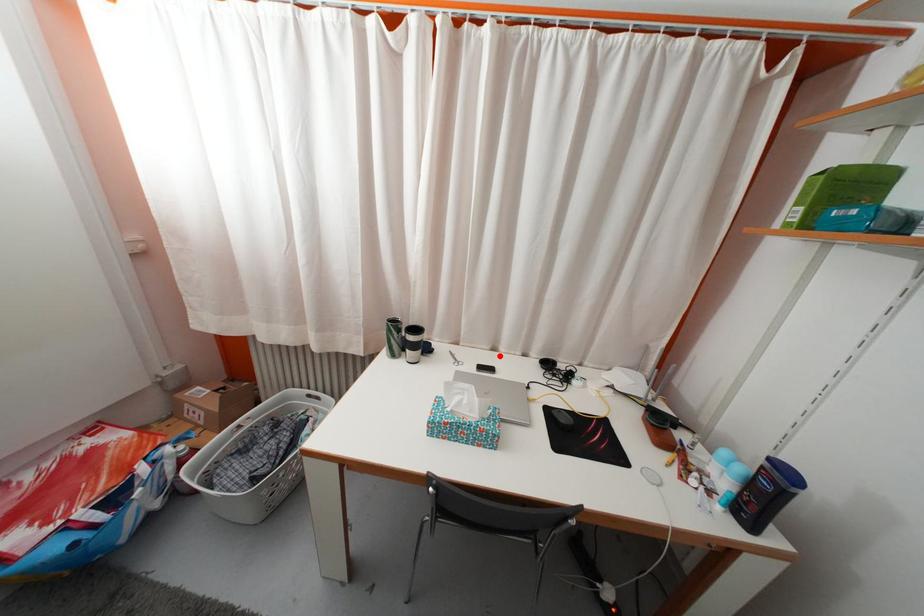
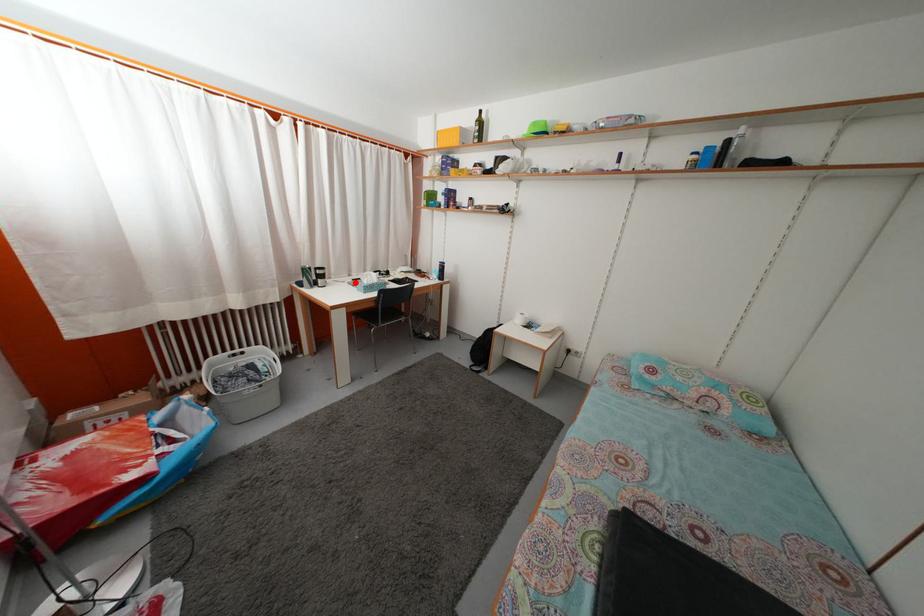
I am providing you with two images of the same scene from different viewpoints. A red point is marked on the first image and another point is marked on the second image. Do the highlighted points in image1 and image2 indicate the same real-world spot?

Yes